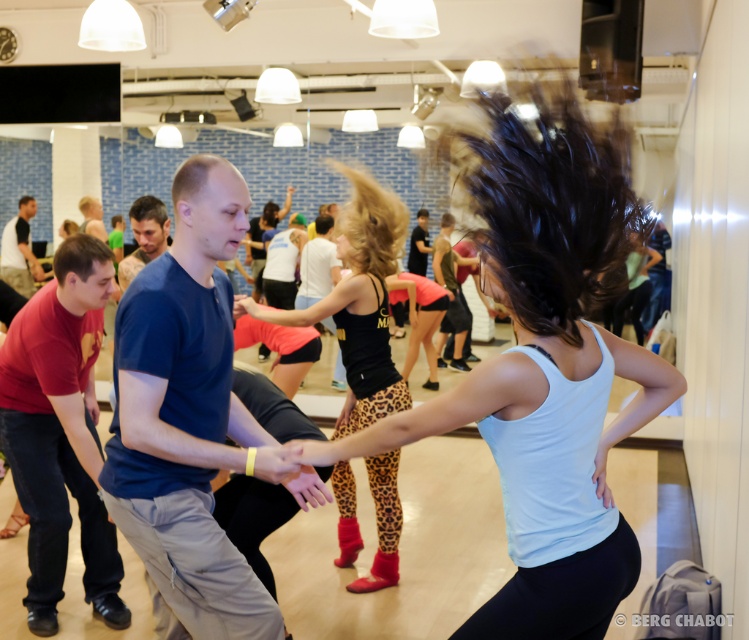
Is point (551, 324) farther from viewer compared to point (351, 483)?

No, it is in front of (351, 483).

Who is shorter, white matte tank top at center or leopard print leggings at center?

With less height is white matte tank top at center.

Which is behind, point (524, 257) or point (354, 424)?

Point (354, 424)

You are a GUI agent. You are given a task and a screenshot of the screen. Output one action in this format:
    pyautogui.click(x=<x>, y=<y>)
    Task: Click on the white matte tank top at center
    
    Given the screenshot: What is the action you would take?
    pyautogui.click(x=545, y=362)